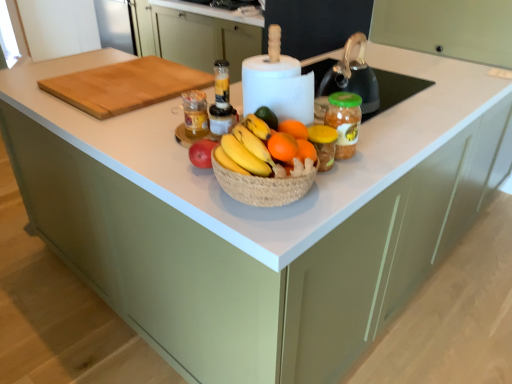
Question: From a real-world perspective, is orange matte grapefruit at center positioned over orangesmoothfruit at center based on gravity?

Choices:
 (A) yes
 (B) no

Answer: (A)

Question: Is orange matte grapefruit at center positioned before orangesmoothfruit at center?

Choices:
 (A) no
 (B) yes

Answer: (B)

Question: From the image's perspective, is orange matte grapefruit at center above orangesmoothfruit at center?

Choices:
 (A) yes
 (B) no

Answer: (A)

Question: From a real-world perspective, is orange matte grapefruit at center under orangesmoothfruit at center?

Choices:
 (A) yes
 (B) no

Answer: (B)

Question: Considering the relative sizes of orange matte grapefruit at center and orangesmoothfruit at center in the image provided, is orange matte grapefruit at center taller than orangesmoothfruit at center?

Choices:
 (A) yes
 (B) no

Answer: (A)

Question: From the image's perspective, is green plastic jar at center positioned above or below orangesmoothfruit at center?

Choices:
 (A) below
 (B) above

Answer: (B)

Question: Is green plastic jar at center in front of or behind orangesmoothfruit at center in the image?

Choices:
 (A) behind
 (B) front

Answer: (A)

Question: Considering the positions of point (336, 150) and point (280, 132), is point (336, 150) closer or farther from the camera than point (280, 132)?

Choices:
 (A) closer
 (B) farther

Answer: (B)

Question: Considering the positions of green plastic jar at center and orangesmoothfruit at center in the image, is green plastic jar at center taller or shorter than orangesmoothfruit at center?

Choices:
 (A) tall
 (B) short

Answer: (A)

Question: Is orange matte grapefruit at center wider or thinner than translucent plastic blender at center, which is the 2th bottle in left-to-right order?

Choices:
 (A) thin
 (B) wide

Answer: (B)

Question: Is orange matte grapefruit at center spatially inside translucent plastic blender at center, which is the 2th bottle in left-to-right order, or outside of it?

Choices:
 (A) outside
 (B) inside

Answer: (A)

Question: From the image's perspective, is orange matte grapefruit at center positioned above or below translucent plastic blender at center, which is the 2th bottle in left-to-right order?

Choices:
 (A) above
 (B) below

Answer: (B)

Question: From a real-world perspective, relative to translucent plastic blender at center, which is the 2th bottle in left-to-right order, is orange matte grapefruit at center vertically above or below?

Choices:
 (A) above
 (B) below

Answer: (B)

Question: Considering the positions of translucent plastic blender at center, the 1th bottle when ordered from right to left, and orangesmoothfruit at center in the image, is translucent plastic blender at center, the 1th bottle when ordered from right to left, bigger or smaller than orangesmoothfruit at center?

Choices:
 (A) big
 (B) small

Answer: (A)

Question: Considering the positions of translucent plastic blender at center, the 1th bottle when ordered from right to left, and orangesmoothfruit at center in the image, is translucent plastic blender at center, the 1th bottle when ordered from right to left, wider or thinner than orangesmoothfruit at center?

Choices:
 (A) thin
 (B) wide

Answer: (A)